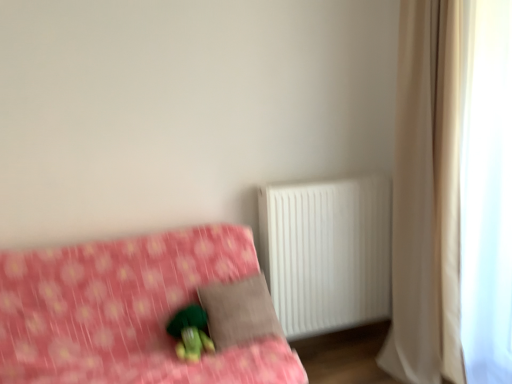
Question: Is beige fabric curtain at right situated inside pink fabric bed at lower left or outside?

Choices:
 (A) outside
 (B) inside

Answer: (A)

Question: Is point (412, 82) positioned closer to the camera than point (218, 256)?

Choices:
 (A) farther
 (B) closer

Answer: (B)

Question: Based on their relative distances, which object is nearer to the beige fabric curtain at right?

Choices:
 (A) white sheer curtain at right
 (B) green plush toy at lower center
 (C) pink fabric bed at lower left
 (D) white plastic radiator at right
 (E) brown fabric pillow at center

Answer: (A)

Question: Which of these objects is positioned farthest from the brown fabric pillow at center?

Choices:
 (A) green plush toy at lower center
 (B) white plastic radiator at right
 (C) pink fabric bed at lower left
 (D) white sheer curtain at right
 (E) beige fabric curtain at right

Answer: (D)